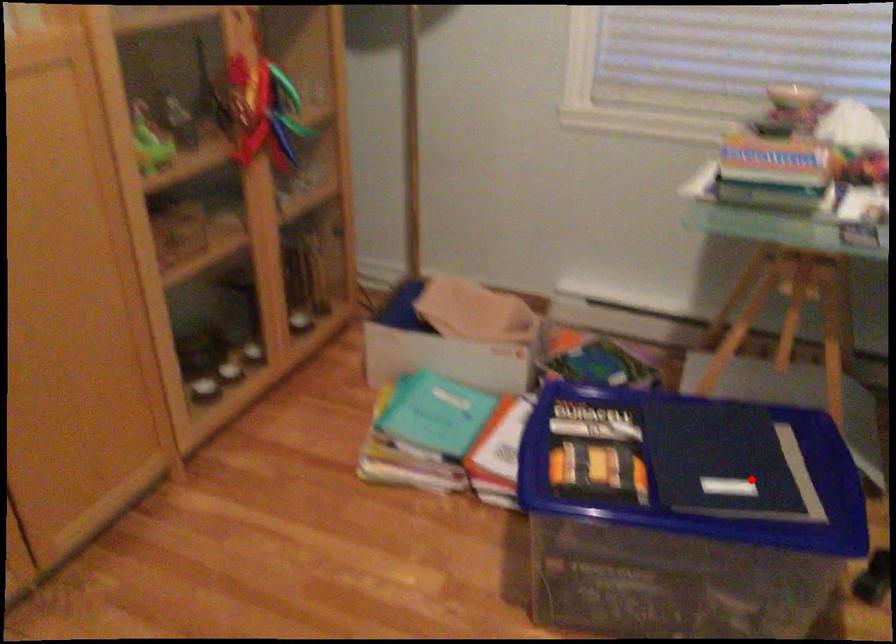
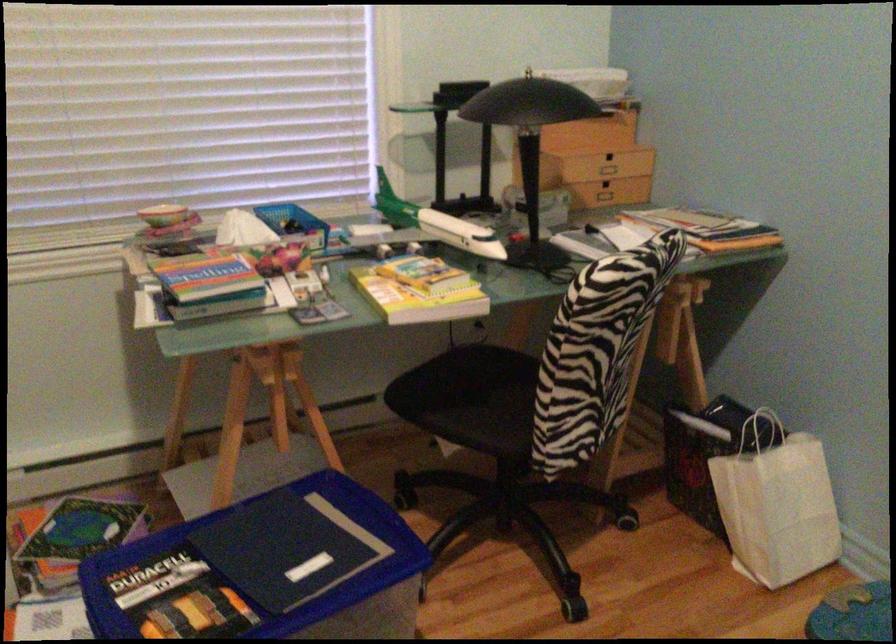
Question: I am providing you with two images of the same scene from different viewpoints. In image1, a red point is highlighted. Considering the same 3D point in image2, which of the following is correct?

Choices:
 (A) It is closer
 (B) It is farther

Answer: (B)